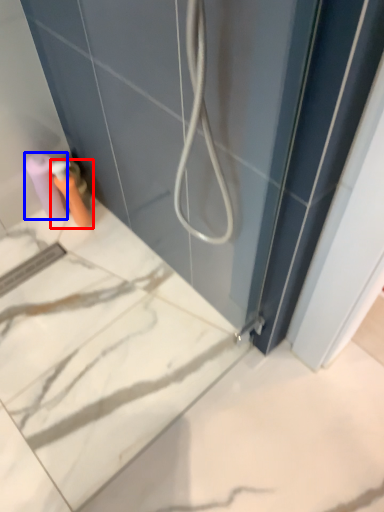
Question: Which object is closer to the camera taking this photo, toiletry (highlighted by a red box) or toilet paper (highlighted by a blue box)?

Choices:
 (A) toiletry
 (B) toilet paper

Answer: (A)